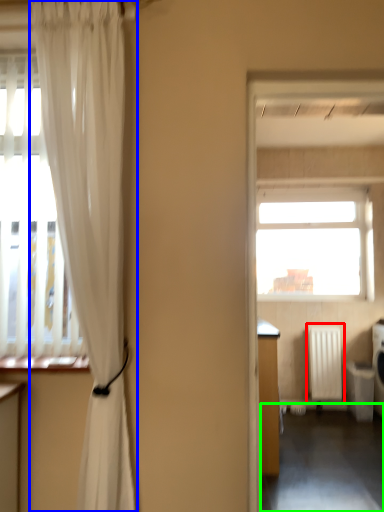
Question: Based on their relative distances, which object is nearer to radiator (highlighted by a red box)? Choose from curtain (highlighted by a blue box) and corridor (highlighted by a green box).

Choices:
 (A) curtain
 (B) corridor

Answer: (B)